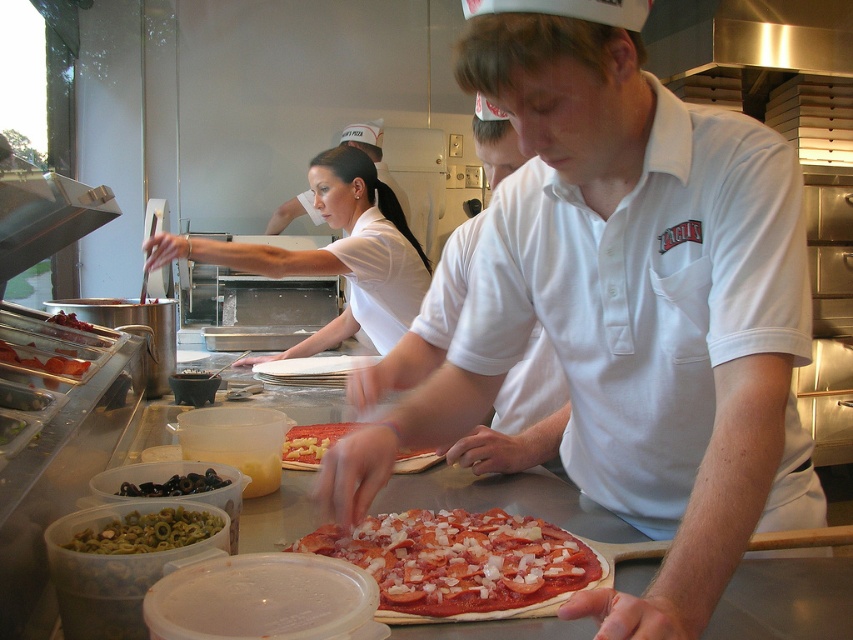
Question: Observing the image, what is the correct spatial positioning of tomato-based crust pizza at center in reference to white smooth uniform at center?

Choices:
 (A) below
 (B) above

Answer: (A)

Question: Can you confirm if tomato-based crust pizza at center is thinner than stainless steel exhaust hood at upper right?

Choices:
 (A) yes
 (B) no

Answer: (A)

Question: Which point is farther to the camera?

Choices:
 (A) white smooth uniform at center
 (B) tomato-based crust pizza at center

Answer: (A)

Question: Can you confirm if stainless steel exhaust hood at upper right is wider than tomato-based dough at center?

Choices:
 (A) yes
 (B) no

Answer: (A)

Question: Which of the following is the farthest from the observer?

Choices:
 (A) green olive oil at lower left
 (B) tomato-based crust pizza at center
 (C) stainless steel exhaust hood at upper right

Answer: (C)

Question: Which object is the closest to the tomato-based crust pizza at center?

Choices:
 (A) white matte shirt at center
 (B) tomato-based dough at center
 (C) white smooth uniform at center

Answer: (A)